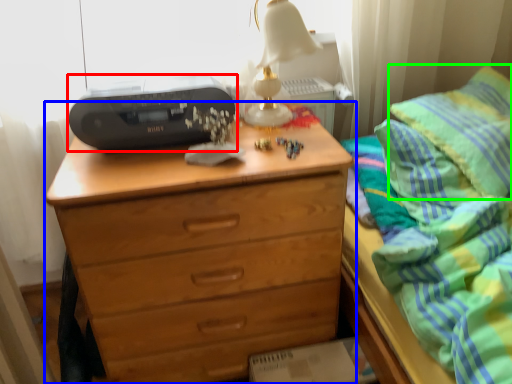
Question: Considering the real-world distances, which object is farthest from printer (highlighted by a red box)? chest of drawers (highlighted by a blue box) or pillow (highlighted by a green box)?

Choices:
 (A) chest of drawers
 (B) pillow

Answer: (B)